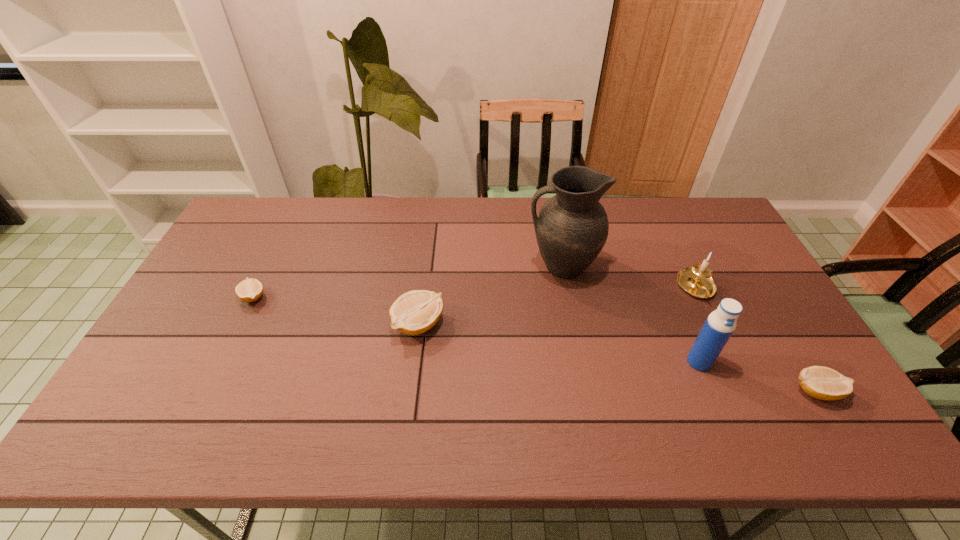
Where is `object that is at the near edge`? The image size is (960, 540). object that is at the near edge is located at coordinates (823, 383).

At what (x,y) coordinates should I click in order to perform the action: click on object that is at the left edge. Please return your answer as a coordinate pair (x, y). The height and width of the screenshot is (540, 960). Looking at the image, I should click on (249, 290).

Find the location of `lemon present at the right edge`. lemon present at the right edge is located at coordinates (823, 383).

Identify the location of candle holder at the right edge. (696, 280).

Where is `object that is at the near right corner`? This screenshot has width=960, height=540. object that is at the near right corner is located at coordinates (823, 383).

Identify the location of vacant region at the far edge. (446, 218).

In order to click on free space at the near edge in this screenshot , I will do (x=339, y=391).

You are a GUI agent. You are given a task and a screenshot of the screen. Output one action in this format:
    pyautogui.click(x=<x>, y=<y>)
    Task: Click on the vacant position at the left edge of the desktop
    The image size is (960, 540).
    Given the screenshot: What is the action you would take?
    pyautogui.click(x=208, y=300)

Identify the location of vacant space at the right edge. (769, 359).

Identify the location of vacant space at the far left corner. (252, 215).